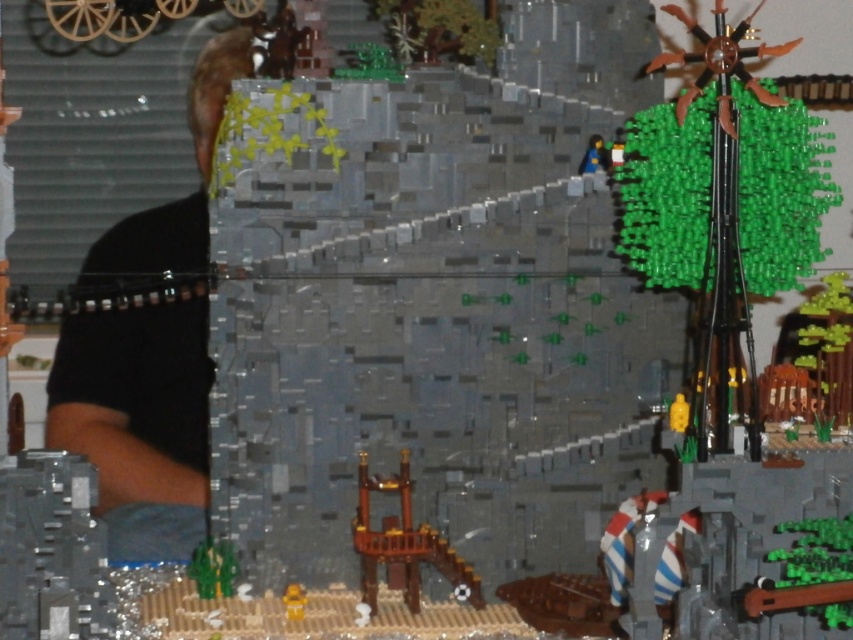
Is black matte shirt at left to the right of blue plastic figure at upper center from the viewer's perspective?

In fact, black matte shirt at left is to the left of blue plastic figure at upper center.

Who is positioned more to the left, black matte shirt at left or blue plastic figure at upper center?

black matte shirt at left

Is point (86, 410) farther from camera compared to point (590, 138)?

Yes, point (86, 410) is farther from viewer.

Identify the location of black matte shirt at left. The height and width of the screenshot is (640, 853). (138, 420).

Can you confirm if black matte shirt at left is smaller than yellow matte figure at lower center?

No.

Does black matte shirt at left appear on the right side of yellow matte figure at lower center?

In fact, black matte shirt at left is to the left of yellow matte figure at lower center.

Does point (201, 186) come behind point (285, 604)?

Yes, point (201, 186) is behind point (285, 604).

You are a GUI agent. You are given a task and a screenshot of the screen. Output one action in this format:
    pyautogui.click(x=<x>, y=<y>)
    Task: Click on the black matte shirt at left
    The width and height of the screenshot is (853, 640).
    Given the screenshot: What is the action you would take?
    pyautogui.click(x=138, y=420)

Which is more to the left, black matte shirt at left or brown wooden tower at center?

black matte shirt at left is more to the left.

Measure the distance between black matte shirt at left and camera.

black matte shirt at left and camera are 1.19 meters apart from each other.

I want to click on black matte shirt at left, so click(x=138, y=420).